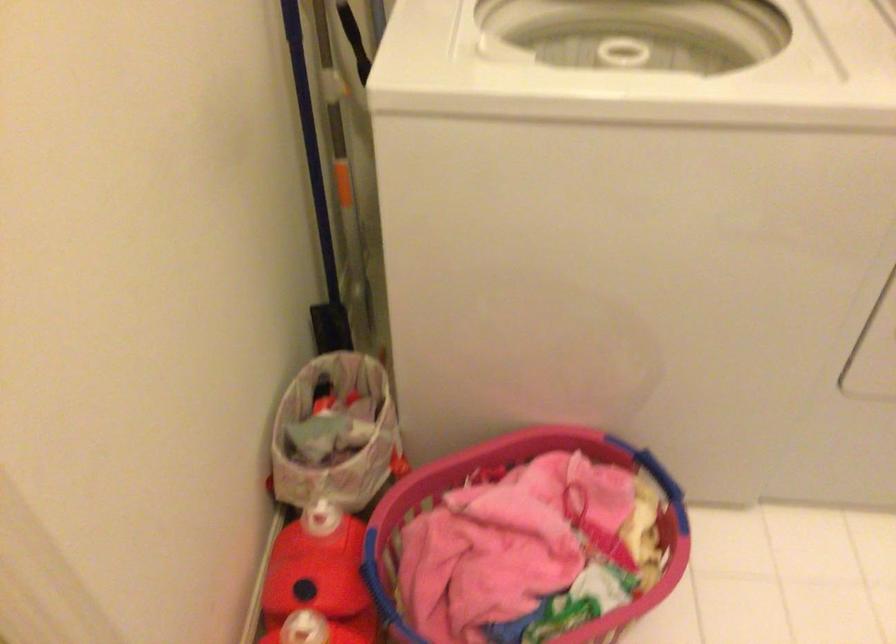
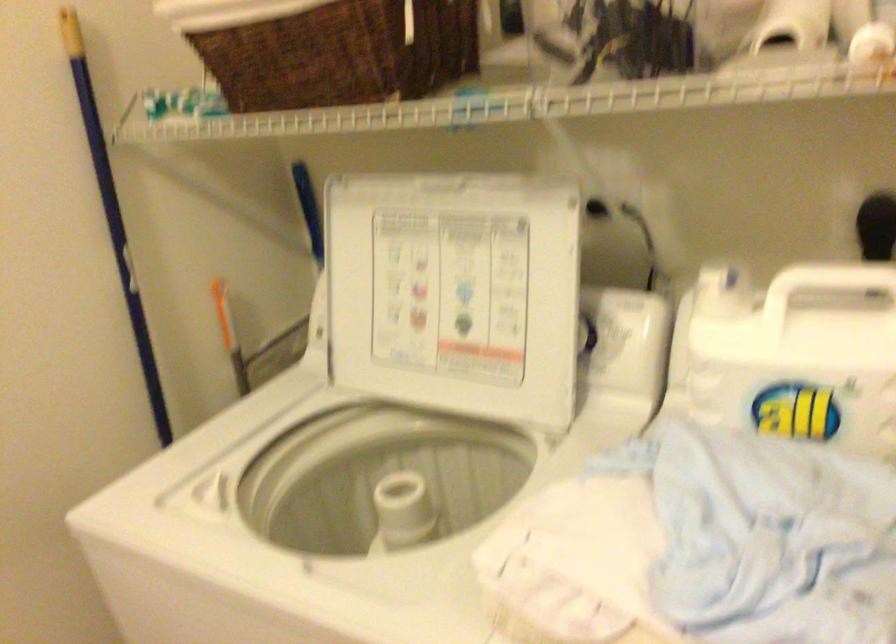
Question: The images are taken continuously from a first-person perspective. In which direction is your viewpoint rotating?

Choices:
 (A) Left
 (B) Right
 (C) Up
 (D) Down

Answer: (A)